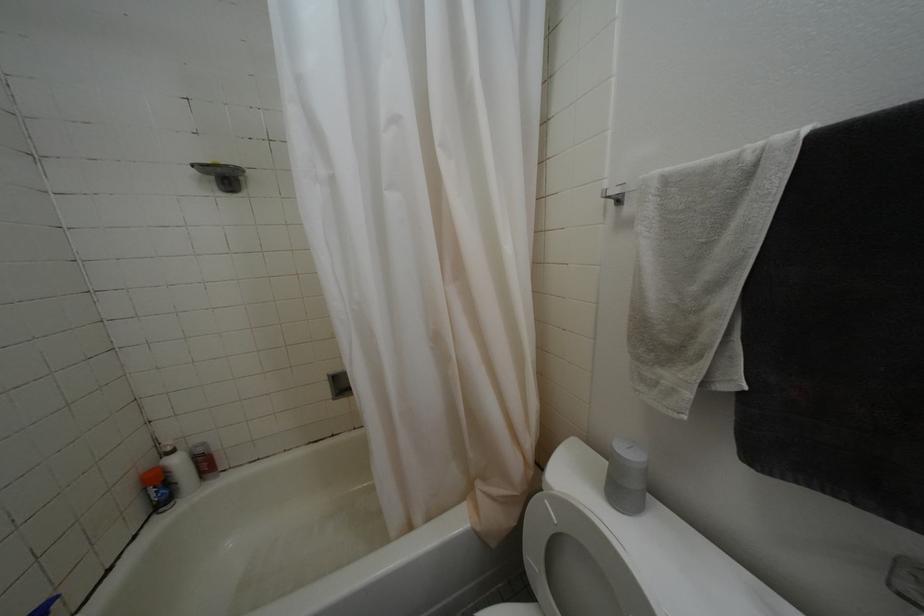
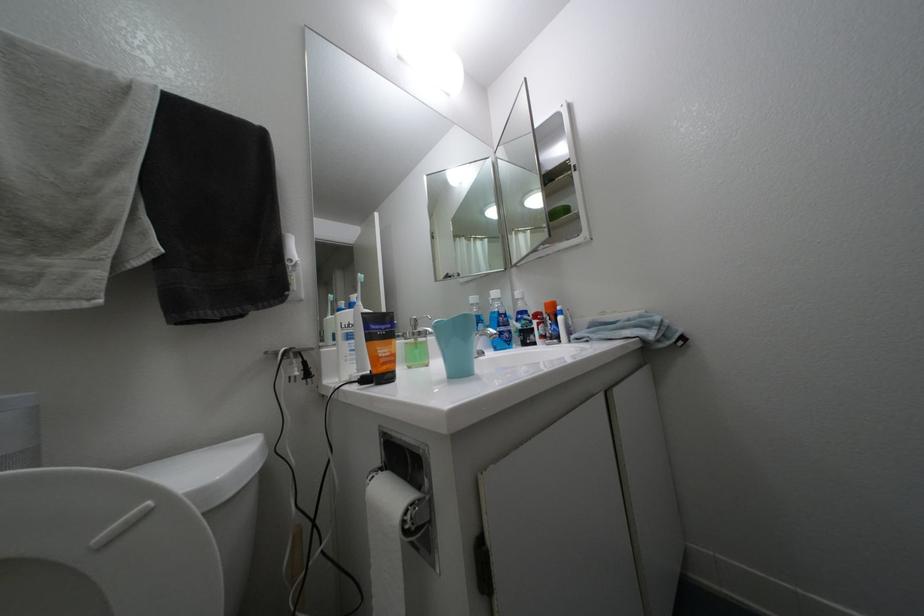
Question: Based on the continuous images, in which direction is the camera rotating? Reply with the corresponding letter.

Choices:
 (A) Left
 (B) Right
 (C) Up
 (D) Down

Answer: (B)